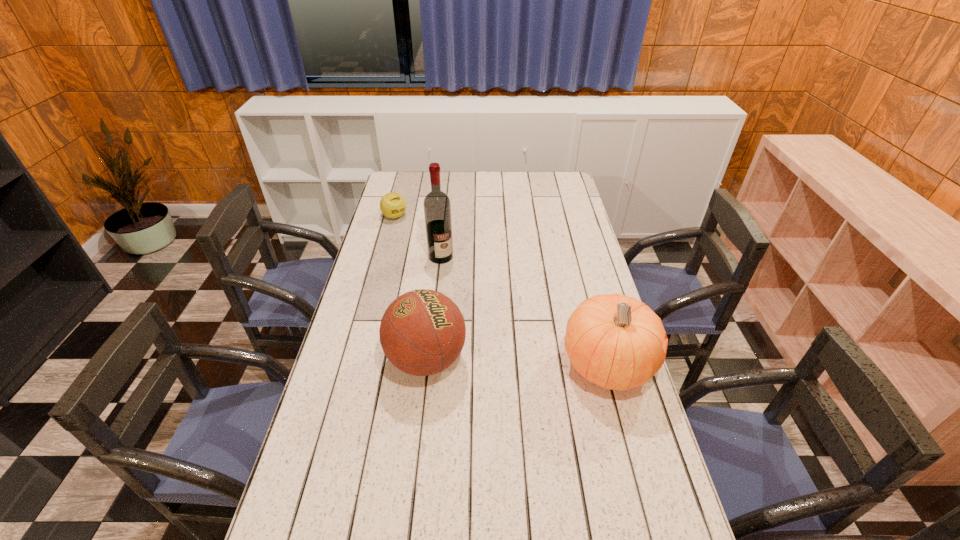
The width and height of the screenshot is (960, 540). In order to click on basketball in this screenshot , I will do pos(422,332).

I want to click on pumpkin, so click(x=617, y=342).

This screenshot has height=540, width=960. In order to click on the tallest object in this screenshot , I will do `click(437, 207)`.

Where is `alcohol`? The image size is (960, 540). alcohol is located at coordinates (437, 207).

Identify the location of softball. (393, 205).

Find the location of `the farthest object`. the farthest object is located at coordinates (393, 205).

You are a GUI agent. You are given a task and a screenshot of the screen. Output one action in this format:
    pyautogui.click(x=<x>, y=<y>)
    Task: Click on the blank space located 0.390m on the back of the basketball
    
    Given the screenshot: What is the action you would take?
    pyautogui.click(x=439, y=255)

Identify the location of free point located on the front and back of the tallest object. (x=467, y=294).

At what (x,y) coordinates should I click in order to perform the action: click on free space located on the front and back of the tallest object. Please return your answer as a coordinate pair (x, y). Looking at the image, I should click on (471, 301).

Where is `vacant space located on the front and back of the tallest object`? This screenshot has height=540, width=960. vacant space located on the front and back of the tallest object is located at coordinates (465, 293).